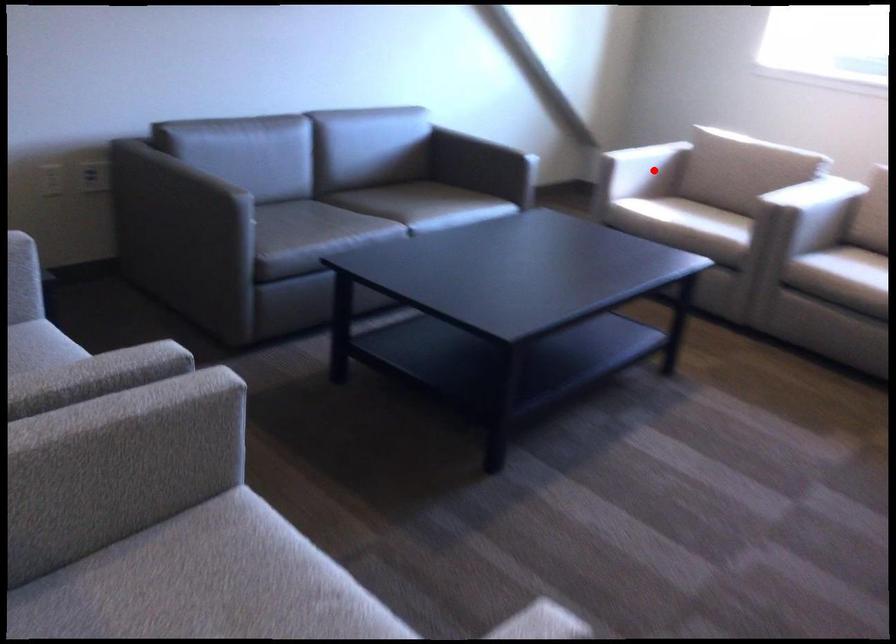
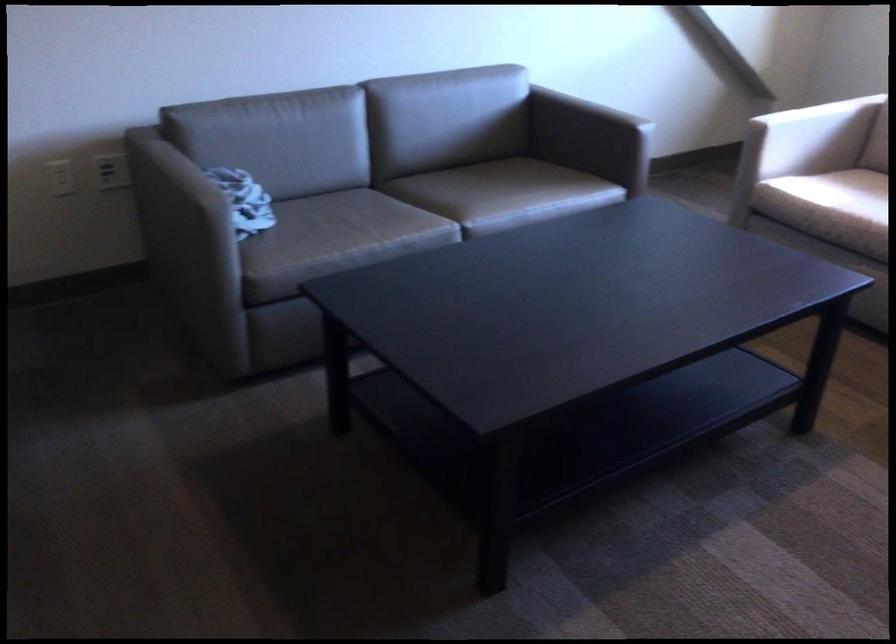
Locate, in the second image, the point that corresponds to the highlighted location in the first image.

(824, 137)